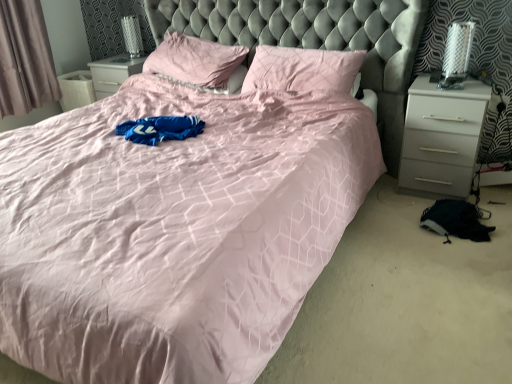
Describe the element at coordinates (442, 137) in the screenshot. I see `white glossy nightstand at right` at that location.

The image size is (512, 384). What do you see at coordinates (195, 60) in the screenshot?
I see `pink fabric pillow at center, which is the 1th pillow from left to right` at bounding box center [195, 60].

I want to click on gray fabric curtain at left, so click(x=25, y=59).

Is gray fabric curtain at left taller than pink satin pillow at upper center, arranged as the first pillow when viewed from the right?

Yes, gray fabric curtain at left is taller than pink satin pillow at upper center, arranged as the first pillow when viewed from the right.

Considering the relative sizes of gray fabric curtain at left and pink satin pillow at upper center, arranged as the first pillow when viewed from the right, in the image provided, is gray fabric curtain at left wider than pink satin pillow at upper center, arranged as the first pillow when viewed from the right,?

No, gray fabric curtain at left is not wider than pink satin pillow at upper center, arranged as the first pillow when viewed from the right.

Image resolution: width=512 pixels, height=384 pixels. What are the coordinates of `the 2nd pillow located beneath the gray fabric curtain at left (from a real-world perspective)` in the screenshot? It's located at click(x=302, y=69).

From a real-world perspective, between gray fabric curtain at left and pink satin pillow at upper center, arranged as the first pillow when viewed from the right, who is vertically lower?

From a 3D spatial view, pink satin pillow at upper center, arranged as the first pillow when viewed from the right, is below.

Which is correct: pink satin pillow at upper center, arranged as the first pillow when viewed from the right, is inside gray fabric curtain at left, or outside of it?

pink satin pillow at upper center, arranged as the first pillow when viewed from the right, is not enclosed by gray fabric curtain at left.

From the image's perspective, is pink satin pillow at upper center, which appears as the second pillow when viewed from the left, located above or below gray fabric curtain at left?

From the image's perspective, pink satin pillow at upper center, which appears as the second pillow when viewed from the left, appears below gray fabric curtain at left.

Between pink satin pillow at upper center, arranged as the first pillow when viewed from the right, and gray fabric curtain at left, which one has more height?

gray fabric curtain at left is taller.

From the image's perspective, between pink fabric pillow at center, which is the second pillow in right-to-left order, and pink satin pillow at upper center, arranged as the first pillow when viewed from the right, which one is located above?

pink fabric pillow at center, which is the second pillow in right-to-left order, is shown above in the image.

From the picture: From a real-world perspective, is pink fabric pillow at center, which is the 1th pillow from left to right, on pink satin pillow at upper center, arranged as the first pillow when viewed from the right?

Indeed, from a real-world perspective, pink fabric pillow at center, which is the 1th pillow from left to right, stands above pink satin pillow at upper center, arranged as the first pillow when viewed from the right.

Who is shorter, pink fabric pillow at center, which is the second pillow in right-to-left order, or pink satin pillow at upper center, which appears as the second pillow when viewed from the left?

Standing shorter between the two is pink satin pillow at upper center, which appears as the second pillow when viewed from the left.

Could you tell me if pink fabric pillow at center, which is the 1th pillow from left to right, is turned towards pink satin pillow at upper center, arranged as the first pillow when viewed from the right?

No.

Is white glossy nightstand at right oriented away from gray fabric curtain at left?

white glossy nightstand at right does not have its back to gray fabric curtain at left.

At what (x,y) coordinates should I click in order to perform the action: click on nightstand located underneath the gray fabric curtain at left (from a real-world perspective). Please return your answer as a coordinate pair (x, y). Image resolution: width=512 pixels, height=384 pixels. Looking at the image, I should click on (442, 137).

From a real-world perspective, is white glossy nightstand at right above or below gray fabric curtain at left?

white glossy nightstand at right is situated lower than gray fabric curtain at left in the real world.

From the image's perspective, which is below, white glossy nightstand at right or gray fabric curtain at left?

white glossy nightstand at right is shown below in the image.

Between pink fabric pillow at center, which is the 1th pillow from left to right, and gray fabric curtain at left, which one is positioned in front?

Positioned in front is pink fabric pillow at center, which is the 1th pillow from left to right.

Is gray fabric curtain at left inside pink fabric pillow at center, which is the 1th pillow from left to right?

No, gray fabric curtain at left is not surrounded by pink fabric pillow at center, which is the 1th pillow from left to right.

From a real-world perspective, who is located lower, pink fabric pillow at center, which is the second pillow in right-to-left order, or gray fabric curtain at left?

pink fabric pillow at center, which is the second pillow in right-to-left order, is physically lower.

Is pink fabric pillow at center, which is the second pillow in right-to-left order, positioned with its back to gray fabric curtain at left?

No, pink fabric pillow at center, which is the second pillow in right-to-left order, is not facing away from gray fabric curtain at left.

From a real-world perspective, which object stands above the other?

In real-world perspective, gray fabric curtain at left is above.

Is gray fabric curtain at left surrounding pink fabric pillow at center, which is the second pillow in right-to-left order?

Actually, pink fabric pillow at center, which is the second pillow in right-to-left order, is outside gray fabric curtain at left.

What's the angular difference between gray fabric curtain at left and pink fabric pillow at center, which is the 1th pillow from left to right,'s facing directions?

The facing directions of gray fabric curtain at left and pink fabric pillow at center, which is the 1th pillow from left to right, are 90.3 degrees apart.

Is gray fabric curtain at left looking in the opposite direction of pink fabric pillow at center, which is the second pillow in right-to-left order?

gray fabric curtain at left is not turned away from pink fabric pillow at center, which is the second pillow in right-to-left order.

Is pink satin pillow at upper center, arranged as the first pillow when viewed from the right, in front of pink fabric pillow at center, which is the second pillow in right-to-left order?

Yes, it is.

Which of these two, pink satin pillow at upper center, arranged as the first pillow when viewed from the right, or pink fabric pillow at center, which is the second pillow in right-to-left order, stands taller?

With more height is pink fabric pillow at center, which is the second pillow in right-to-left order.

Would you say pink satin pillow at upper center, arranged as the first pillow when viewed from the right, is inside or outside pink fabric pillow at center, which is the second pillow in right-to-left order?

pink satin pillow at upper center, arranged as the first pillow when viewed from the right, is not inside pink fabric pillow at center, which is the second pillow in right-to-left order, it's outside.

Is pink satin pillow at upper center, which appears as the second pillow when viewed from the left, facing towards pink fabric pillow at center, which is the 1th pillow from left to right?

No.

Identify the location of the 2nd pillow in front of the gray fabric curtain at left. The image size is (512, 384). (302, 69).

From the image's perspective, which pillow is the 2nd one below the gray fabric curtain at left? Please provide its 2D coordinates.

[(302, 69)]

Estimate the real-world distances between objects in this image. Which object is closer to white glossy nightstand at right, pink fabric pillow at center, which is the second pillow in right-to-left order, or pink satin pillow at upper center, arranged as the first pillow when viewed from the right?

Based on the image, pink satin pillow at upper center, arranged as the first pillow when viewed from the right, appears to be nearer to white glossy nightstand at right.

Considering their positions, is gray fabric curtain at left positioned closer to white glossy nightstand at right than pink satin pillow at upper center, arranged as the first pillow when viewed from the right?

The object closer to white glossy nightstand at right is pink satin pillow at upper center, arranged as the first pillow when viewed from the right.

Based on their spatial positions, is gray fabric curtain at left or white glossy nightstand at right further from pink fabric pillow at center, which is the second pillow in right-to-left order?

white glossy nightstand at right is positioned further to the anchor pink fabric pillow at center, which is the second pillow in right-to-left order.

Considering their positions, is white glossy nightstand at right positioned further to pink satin pillow at upper center, arranged as the first pillow when viewed from the right, than pink fabric pillow at center, which is the second pillow in right-to-left order?

The object further to pink satin pillow at upper center, arranged as the first pillow when viewed from the right, is white glossy nightstand at right.

Considering their positions, is white glossy nightstand at right positioned closer to pink fabric pillow at center, which is the 1th pillow from left to right, than gray fabric curtain at left?

gray fabric curtain at left is closer to pink fabric pillow at center, which is the 1th pillow from left to right.

Which object lies further to the anchor point pink satin pillow at upper center, which appears as the second pillow when viewed from the left, white glossy nightstand at right or gray fabric curtain at left?

gray fabric curtain at left is further to pink satin pillow at upper center, which appears as the second pillow when viewed from the left.

When comparing their distances from pink fabric pillow at center, which is the 1th pillow from left to right, does gray fabric curtain at left or pink satin pillow at upper center, which appears as the second pillow when viewed from the left, seem further?

gray fabric curtain at left lies further to pink fabric pillow at center, which is the 1th pillow from left to right, than the other object.

Considering their positions, is gray fabric curtain at left positioned further to white glossy nightstand at right than pink fabric pillow at center, which is the second pillow in right-to-left order?

The object further to white glossy nightstand at right is gray fabric curtain at left.

You are a GUI agent. You are given a task and a screenshot of the screen. Output one action in this format:
    pyautogui.click(x=<x>, y=<y>)
    Task: Click on the pillow situated between pink fabric pillow at center, which is the 1th pillow from left to right, and white glossy nightstand at right from left to right
    This screenshot has height=384, width=512.
    Given the screenshot: What is the action you would take?
    pyautogui.click(x=302, y=69)

At what (x,y) coordinates should I click in order to perform the action: click on pillow between gray fabric curtain at left and pink satin pillow at upper center, which appears as the second pillow when viewed from the left, in the horizontal direction. Please return your answer as a coordinate pair (x, y). The width and height of the screenshot is (512, 384). Looking at the image, I should click on pos(195,60).